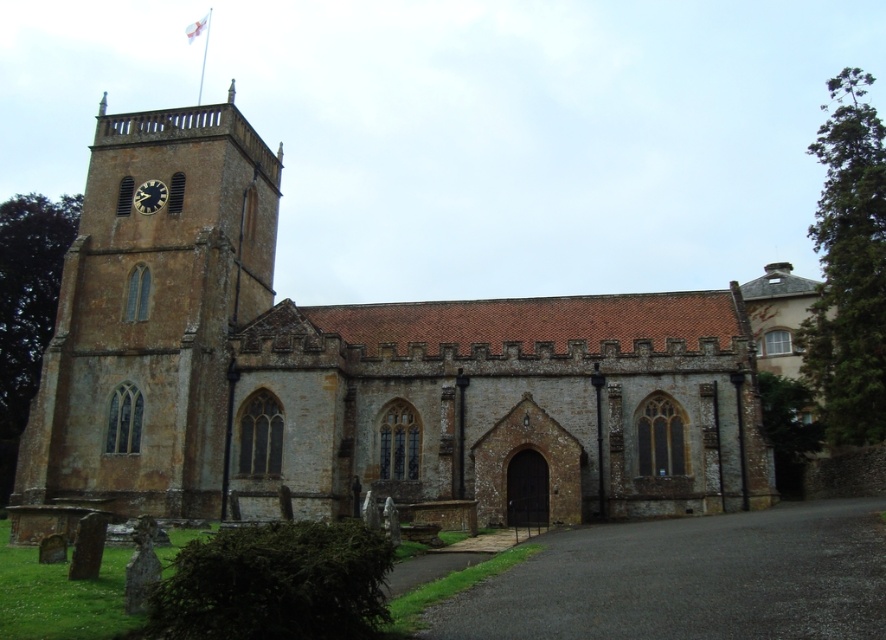
You are standing in front of the brown stone church at center and looking up. You notice the matte black clock at upper left. Which object is taller?

The brown stone church at center is taller than the matte black clock at upper left.

Based on the photo, you are standing in front of the brown stone church at center and want to locate the matte black clock at upper left. Based on the scene, which direction should you turn your head to see it?

The brown stone church at center is to the right of the matte black clock at upper left, so you should turn your head to the left to see the matte black clock at upper left.